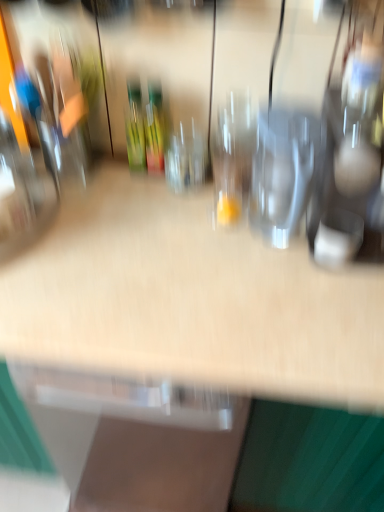
Where is `transparent glass wine glass at center, acting as the third wine glass starting from the left`? This screenshot has width=384, height=512. transparent glass wine glass at center, acting as the third wine glass starting from the left is located at coordinates (282, 172).

In order to face transparent glass at center, the 2th wine glass positioned from the right, should I rotate leftwards or rightwards?

It's best to rotate right around 6.316 degrees.

What do you see at coordinates (233, 156) in the screenshot?
I see `transparent glass at center, which appears as the second wine glass when viewed from the left` at bounding box center [233, 156].

What do you see at coordinates (185, 159) in the screenshot? This screenshot has width=384, height=512. I see `transparent glass wine glass at center, which is the 3th wine glass from right to left` at bounding box center [185, 159].

What do you see at coordinates (155, 129) in the screenshot? I see `green glass wine bottle at center` at bounding box center [155, 129].

You are a GUI agent. You are given a task and a screenshot of the screen. Output one action in this format:
    pyautogui.click(x=<x>, y=<y>)
    Task: Click on the green glass bottle at center
    Image resolution: width=384 pixels, height=512 pixels.
    Given the screenshot: What is the action you would take?
    pyautogui.click(x=135, y=127)

Do you think green glass bottle at center is within transparent glass wine glass at center, which appears as the first wine glass when viewed from the left, or outside of it?

green glass bottle at center is not enclosed by transparent glass wine glass at center, which appears as the first wine glass when viewed from the left.

Based on the photo, considering the sizes of green glass bottle at center and transparent glass wine glass at center, which is the 3th wine glass from right to left, in the image, is green glass bottle at center wider or thinner than transparent glass wine glass at center, which is the 3th wine glass from right to left,?

In the image, green glass bottle at center appears to be more narrow than transparent glass wine glass at center, which is the 3th wine glass from right to left.

From the image's perspective, which one is positioned lower, green glass bottle at center or transparent glass wine glass at center, which appears as the first wine glass when viewed from the left?

transparent glass wine glass at center, which appears as the first wine glass when viewed from the left, is shown below in the image.

Can you confirm if green glass bottle at center is taller than transparent glass wine glass at center, which appears as the first wine glass when viewed from the left?

Yes, green glass bottle at center is taller than transparent glass wine glass at center, which appears as the first wine glass when viewed from the left.

From a real-world perspective, who is located lower, transparent glass wine glass at center, which appears as the first wine glass when viewed from the left, or green glass bottle at center?

transparent glass wine glass at center, which appears as the first wine glass when viewed from the left, from a real-world perspective.

In the scene shown: From the image's perspective, who appears lower, transparent glass wine glass at center, which is the 3th wine glass from right to left, or green glass bottle at center?

From the image's view, transparent glass wine glass at center, which is the 3th wine glass from right to left, is below.

Is there a large distance between transparent glass wine glass at center, which appears as the first wine glass when viewed from the left, and green glass bottle at center?

That's not correct — transparent glass wine glass at center, which appears as the first wine glass when viewed from the left, is a little close to green glass bottle at center.

From the image's perspective, which one is positioned higher, transparent glass wine glass at center, which appears as the first wine glass when viewed from the left, or green glass wine bottle at center?

From the image's view, green glass wine bottle at center is above.

Considering the positions of objects transparent glass wine glass at center, which appears as the first wine glass when viewed from the left, and green glass wine bottle at center in the image provided, who is in front, transparent glass wine glass at center, which appears as the first wine glass when viewed from the left, or green glass wine bottle at center?

transparent glass wine glass at center, which appears as the first wine glass when viewed from the left, is more forward.

In the scene shown: Is transparent glass wine glass at center, which is the 3th wine glass from right to left, turned away from green glass wine bottle at center?

transparent glass wine glass at center, which is the 3th wine glass from right to left, does not have its back to green glass wine bottle at center.

Is transparent glass wine glass at center, which appears as the first wine glass when viewed from the left, beside green glass wine bottle at center?

Yes, transparent glass wine glass at center, which appears as the first wine glass when viewed from the left, is touching green glass wine bottle at center.

Is transparent glass wine glass at center, the 1th wine glass viewed from the right, facing towards green glass wine bottle at center?

No, transparent glass wine glass at center, the 1th wine glass viewed from the right, is not aimed at green glass wine bottle at center.

Which object is wider, transparent glass wine glass at center, the 1th wine glass viewed from the right, or green glass wine bottle at center?

transparent glass wine glass at center, the 1th wine glass viewed from the right, is wider.

Relative to green glass wine bottle at center, is transparent glass wine glass at center, acting as the third wine glass starting from the left, in front or behind?

transparent glass wine glass at center, acting as the third wine glass starting from the left, is in front of green glass wine bottle at center.

Does point (129, 128) come farther from viewer compared to point (245, 144)?

That is False.

From the image's perspective, is green glass bottle at center above transparent glass at center, which appears as the second wine glass when viewed from the left?

Correct, green glass bottle at center appears higher than transparent glass at center, which appears as the second wine glass when viewed from the left, in the image.

Which is in front, green glass bottle at center or transparent glass at center, which appears as the second wine glass when viewed from the left?

transparent glass at center, which appears as the second wine glass when viewed from the left.

Based on the photo, is green glass bottle at center in contact with transparent glass at center, which appears as the second wine glass when viewed from the left?

They are not placed beside each other.

In the image, is green glass bottle at center positioned in front of or behind transparent glass wine glass at center, the 1th wine glass viewed from the right?

Clearly, green glass bottle at center is behind transparent glass wine glass at center, the 1th wine glass viewed from the right.

Could you measure the distance between green glass bottle at center and transparent glass wine glass at center, the 1th wine glass viewed from the right?

A distance of 13.95 inches exists between green glass bottle at center and transparent glass wine glass at center, the 1th wine glass viewed from the right.

Is green glass bottle at center placed right next to transparent glass wine glass at center, the 1th wine glass viewed from the right?

green glass bottle at center and transparent glass wine glass at center, the 1th wine glass viewed from the right, are not in contact.

From the image's perspective, which is below, transparent glass at center, the 2th wine glass positioned from the right, or green glass bottle at center?

transparent glass at center, the 2th wine glass positioned from the right, appears lower in the image.

Which of these two, transparent glass at center, the 2th wine glass positioned from the right, or green glass bottle at center, is thinner?

Thinner between the two is green glass bottle at center.

Would you say transparent glass at center, which appears as the second wine glass when viewed from the left, is outside green glass bottle at center?

Indeed, transparent glass at center, which appears as the second wine glass when viewed from the left, is completely outside green glass bottle at center.

What are the coordinates of `wine glass that is the 2nd one below the green glass bottle at center (from a real-world perspective)` in the screenshot? It's located at (185, 159).

Find the location of a particular element. The width and height of the screenshot is (384, 512). bottle that is behind the transparent glass wine glass at center, which appears as the first wine glass when viewed from the left is located at coordinates (135, 127).

Considering their positions, is transparent glass wine glass at center, the 1th wine glass viewed from the right, positioned further to green glass wine bottle at center than transparent glass wine glass at center, which is the 3th wine glass from right to left?

Among the two, transparent glass wine glass at center, the 1th wine glass viewed from the right, is located further to green glass wine bottle at center.

When comparing their distances from transparent glass wine glass at center, which is the 3th wine glass from right to left, does transparent glass wine glass at center, the 1th wine glass viewed from the right, or green glass bottle at center seem closer?

green glass bottle at center is positioned closer to the anchor transparent glass wine glass at center, which is the 3th wine glass from right to left.

Estimate the real-world distances between objects in this image. Which object is further from transparent glass wine glass at center, the 1th wine glass viewed from the right, green glass bottle at center or transparent glass at center, the 2th wine glass positioned from the right?

green glass bottle at center.

Looking at the image, which one is located further to green glass wine bottle at center, green glass bottle at center or transparent glass wine glass at center, which appears as the first wine glass when viewed from the left?

The object further to green glass wine bottle at center is transparent glass wine glass at center, which appears as the first wine glass when viewed from the left.

Which object lies nearer to the anchor point transparent glass wine glass at center, acting as the third wine glass starting from the left, transparent glass wine glass at center, which appears as the first wine glass when viewed from the left, or transparent glass at center, which appears as the second wine glass when viewed from the left?

Based on the image, transparent glass at center, which appears as the second wine glass when viewed from the left, appears to be nearer to transparent glass wine glass at center, acting as the third wine glass starting from the left.

Looking at the image, which one is located further to transparent glass wine glass at center, which appears as the first wine glass when viewed from the left, green glass wine bottle at center or green glass bottle at center?

Based on the image, green glass bottle at center appears to be further to transparent glass wine glass at center, which appears as the first wine glass when viewed from the left.

Considering their positions, is green glass bottle at center positioned closer to transparent glass wine glass at center, which is the 3th wine glass from right to left, than green glass wine bottle at center?

Among the two, green glass wine bottle at center is located nearer to transparent glass wine glass at center, which is the 3th wine glass from right to left.

When comparing their distances from transparent glass at center, which appears as the second wine glass when viewed from the left, does green glass wine bottle at center or transparent glass wine glass at center, which appears as the first wine glass when viewed from the left, seem further?

Based on the image, green glass wine bottle at center appears to be further to transparent glass at center, which appears as the second wine glass when viewed from the left.

Locate an element on the screen. wine glass between green glass bottle at center and transparent glass at center, which appears as the second wine glass when viewed from the left, from left to right is located at coordinates (185, 159).

You are a GUI agent. You are given a task and a screenshot of the screen. Output one action in this format:
    pyautogui.click(x=<x>, y=<y>)
    Task: Click on the wine glass located between transparent glass wine glass at center, acting as the third wine glass starting from the left, and transparent glass wine glass at center, which appears as the first wine glass when viewed from the left, in the depth direction
    The width and height of the screenshot is (384, 512).
    Given the screenshot: What is the action you would take?
    pyautogui.click(x=233, y=156)

I want to click on wine glass located between green glass wine bottle at center and transparent glass at center, which appears as the second wine glass when viewed from the left, in the left-right direction, so click(x=185, y=159).

At what (x,y) coordinates should I click in order to perform the action: click on wine bottle between green glass bottle at center and transparent glass wine glass at center, acting as the third wine glass starting from the left, from left to right. Please return your answer as a coordinate pair (x, y). The image size is (384, 512). Looking at the image, I should click on (155, 129).